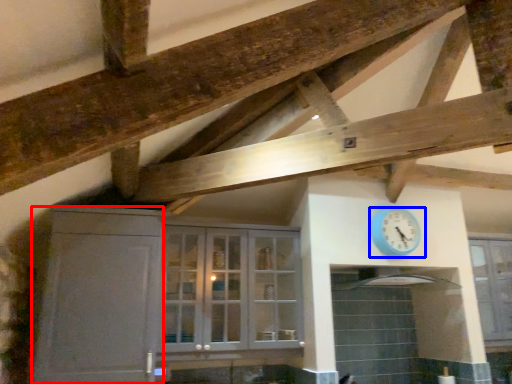
Question: Which object is further to the camera taking this photo, cabinetry (highlighted by a red box) or wall clock (highlighted by a blue box)?

Choices:
 (A) cabinetry
 (B) wall clock

Answer: (B)